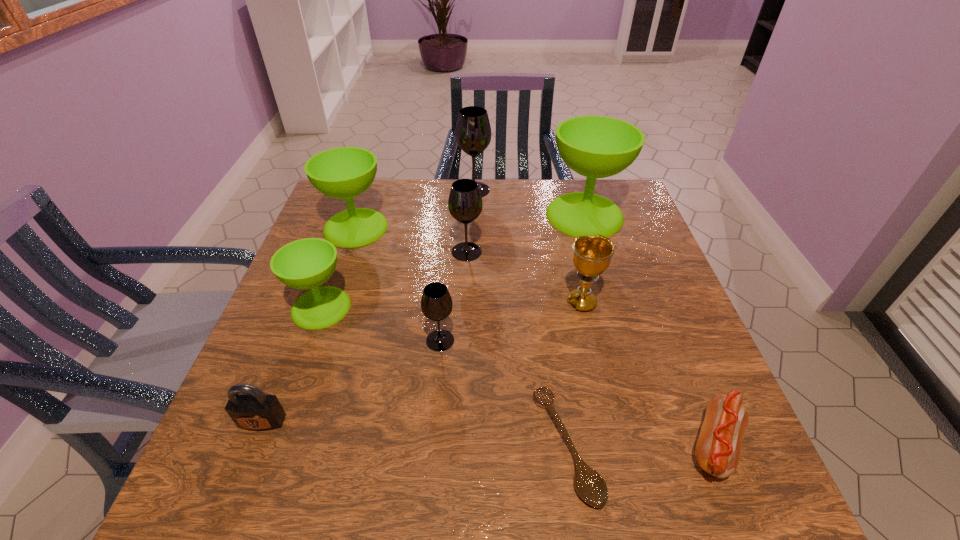
You are a GUI agent. You are given a task and a screenshot of the screen. Output one action in this format:
    pyautogui.click(x=<x>, y=<y>)
    Task: Click on the empty space between the chalice and the farthest gray wineglass
    Image resolution: width=960 pixels, height=540 pixels.
    Given the screenshot: What is the action you would take?
    pyautogui.click(x=528, y=246)

At what (x,y) coordinates should I click in order to perform the action: click on empty space that is in between the rightmost green wineglass and the biggest gray wineglass. Please return your answer as a coordinate pair (x, y). Image resolution: width=960 pixels, height=540 pixels. Looking at the image, I should click on (529, 202).

Find the location of `free spot between the gray padlock and the gold chalice`. free spot between the gray padlock and the gold chalice is located at coordinates (422, 362).

Locate an element on the screen. The height and width of the screenshot is (540, 960). free space between the ladle and the chalice is located at coordinates (574, 374).

The image size is (960, 540). Find the location of `free spot between the brown sausage and the padlock`. free spot between the brown sausage and the padlock is located at coordinates (489, 434).

The image size is (960, 540). Find the location of `free space between the biggest gray wineglass and the rightmost wineglass`. free space between the biggest gray wineglass and the rightmost wineglass is located at coordinates (529, 202).

You are a GUI agent. You are given a task and a screenshot of the screen. Output one action in this format:
    pyautogui.click(x=<x>, y=<y>)
    Task: Click on the vacant space in between the gray padlock and the smallest green wineglass
    The image size is (960, 540).
    Given the screenshot: What is the action you would take?
    pyautogui.click(x=292, y=364)

Find the location of a particular element. the fourth closest object to the second smallest gray wineglass is located at coordinates (591, 254).

Identify the location of the fourth closest object to the second smallest gray wineglass. (591, 254).

Locate which wineglass is the third closest to the nearest green wineglass. Please provide its 2D coordinates. Your answer should be formatted as a tuple, i.e. [(x, y)], where the tuple contains the x and y coordinates of a point satisfying the conditions above.

[(465, 203)]